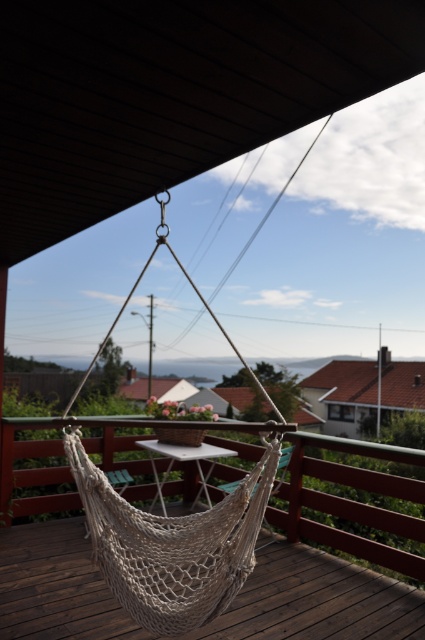
Is white rope hammock at center smaller than white mesh hammock at center?

Correct, white rope hammock at center occupies less space than white mesh hammock at center.

Can you confirm if white rope hammock at center is positioned below white mesh hammock at center?

Correct, white rope hammock at center is located below white mesh hammock at center.

Identify the location of white rope hammock at center. (155, 528).